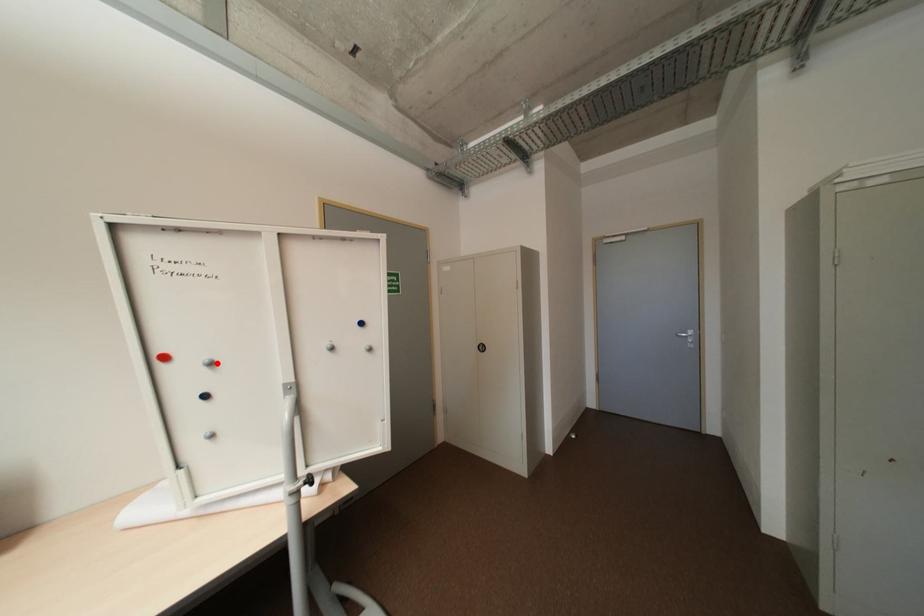
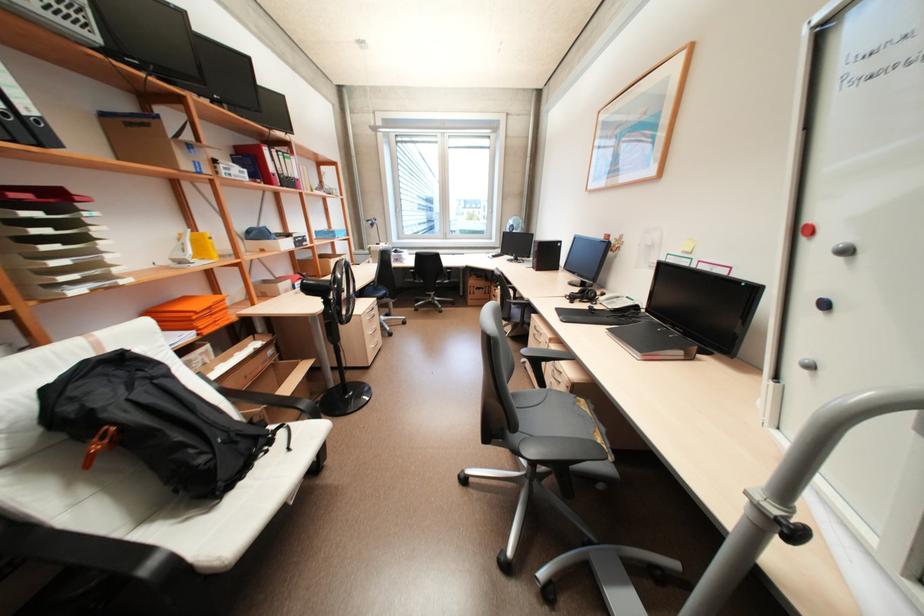
In the second image, find the point that corresponds to the highlighted location in the first image.

(852, 252)